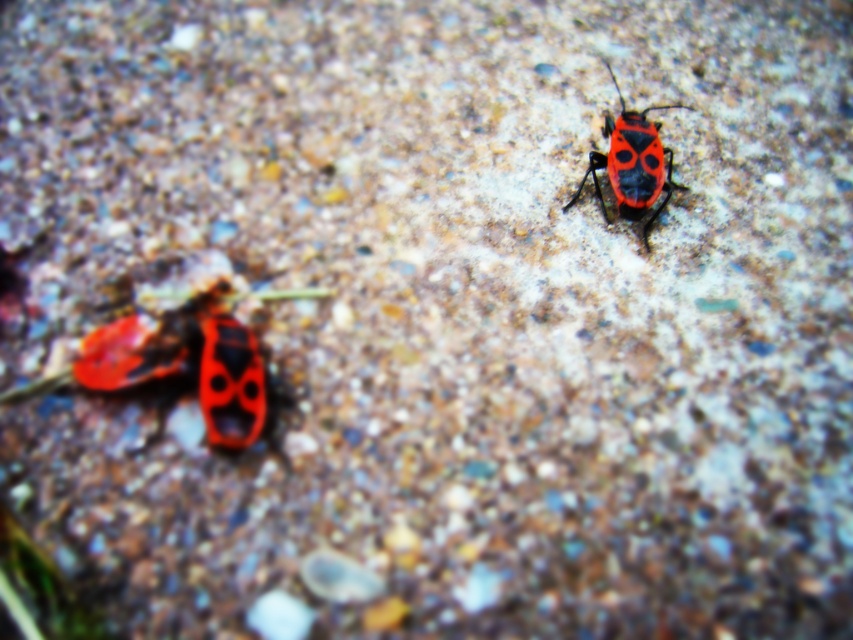
Question: Which point is closer to the camera?

Choices:
 (A) (653, 193)
 (B) (143, 332)

Answer: (B)

Question: Does shiny red beetle at left have a greater width compared to shiny red beetle at upper right?

Choices:
 (A) yes
 (B) no

Answer: (A)

Question: Can you confirm if shiny red beetle at left is positioned to the right of shiny red beetle at upper right?

Choices:
 (A) no
 (B) yes

Answer: (A)

Question: Does shiny red beetle at left appear under shiny red beetle at upper right?

Choices:
 (A) no
 (B) yes

Answer: (B)